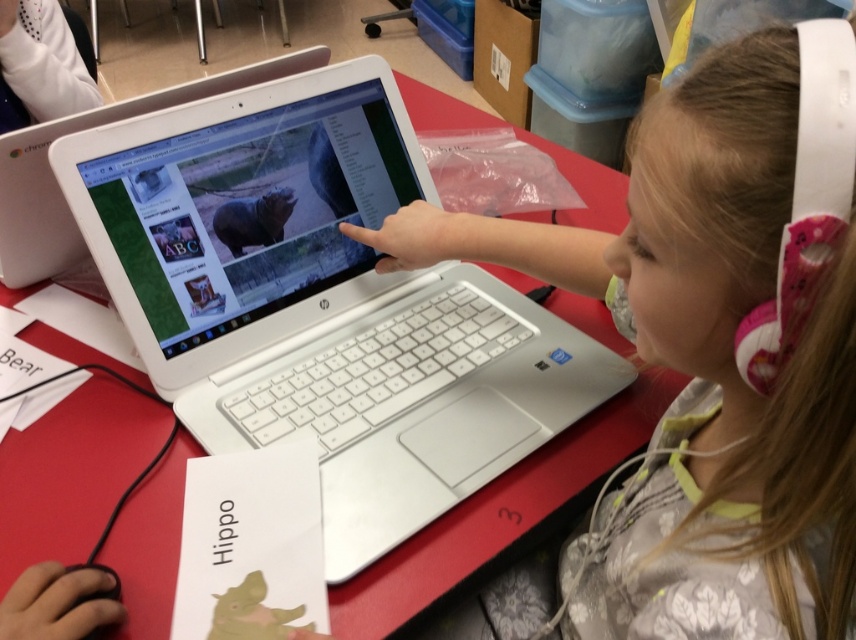
You are a student who needs to reach the white plastic laptop at center from your current position. The classroom has a rule that you must stay at least 60 centimeters away from the laptop to prevent screen glare. Can you safely approach the laptop without violating the rule?

The distance of white plastic laptop at center from camera is 56.80 centimeters. Since the required minimum distance is 60 centimeters, approaching the laptop would violate the rule. You need to stay further back.

You are a student sitting at the red table. You need to reach the white plastic laptop at center to hand in your assignment. Can you comfortably reach it without moving your chair?

The white plastic laptop at center is 22.36 inches away from you, which is within a comfortable reaching distance for most people, so yes, you can comfortably reach it without moving your chair.